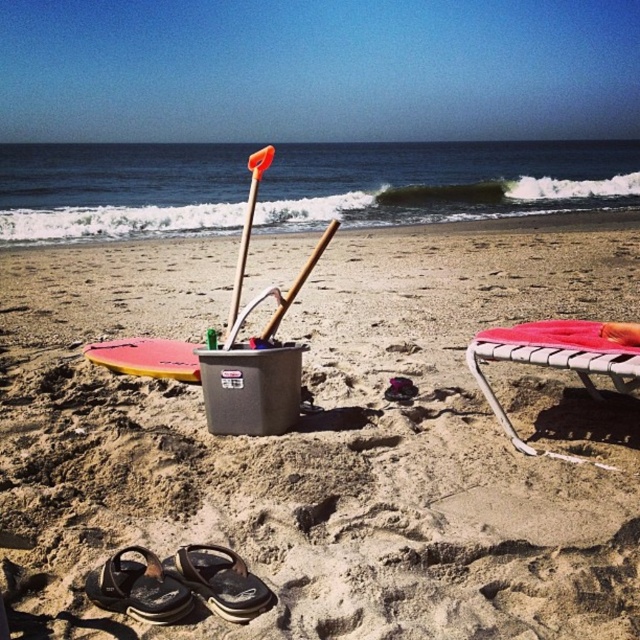
Between black rubber sandal at lower center and yellow matte surfboard at lower left, which one has more height?

yellow matte surfboard at lower left is taller.

Is black rubber sandal at lower center to the left of yellow matte surfboard at lower left from the viewer's perspective?

No, black rubber sandal at lower center is not to the left of yellow matte surfboard at lower left.

Describe the element at coordinates (220, 580) in the screenshot. I see `black rubber sandal at lower center` at that location.

Where is `black rubber sandal at lower center`? The width and height of the screenshot is (640, 640). black rubber sandal at lower center is located at coordinates (220, 580).

Is black rubber sandal at lower center to the left of wooden shovel at center from the viewer's perspective?

Correct, you'll find black rubber sandal at lower center to the left of wooden shovel at center.

This screenshot has height=640, width=640. What do you see at coordinates (220, 580) in the screenshot? I see `black rubber sandal at lower center` at bounding box center [220, 580].

You are a GUI agent. You are given a task and a screenshot of the screen. Output one action in this format:
    pyautogui.click(x=<x>, y=<y>)
    Task: Click on the black rubber sandal at lower center
    The image size is (640, 640).
    Given the screenshot: What is the action you would take?
    pyautogui.click(x=220, y=580)

Is point (106, 348) positioned after point (248, 164)?

No.

Measure the distance between point (125,344) and camera.

Point (125,344) and camera are 4.96 meters apart.

Which is behind, point (115, 362) or point (253, 168)?

Point (115, 362)

This screenshot has width=640, height=640. I want to click on yellow matte surfboard at lower left, so click(x=147, y=356).